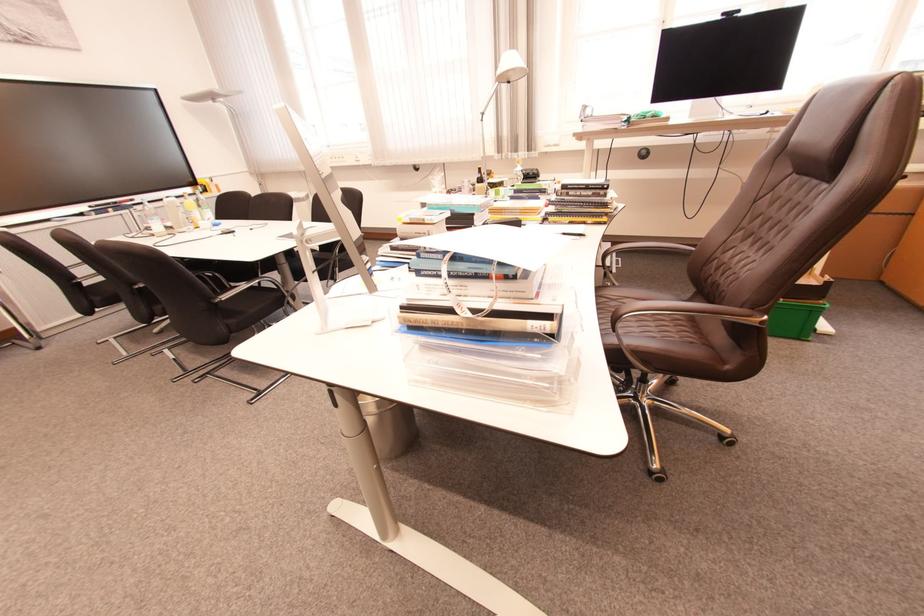
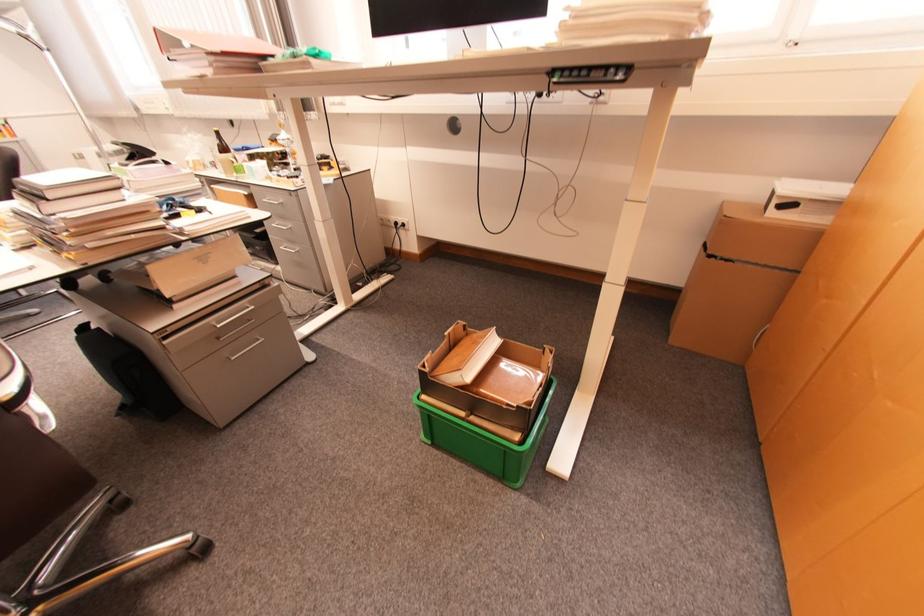
Which direction would the cameraman need to move to produce the second image?

The cameraman moved toward right, forward.